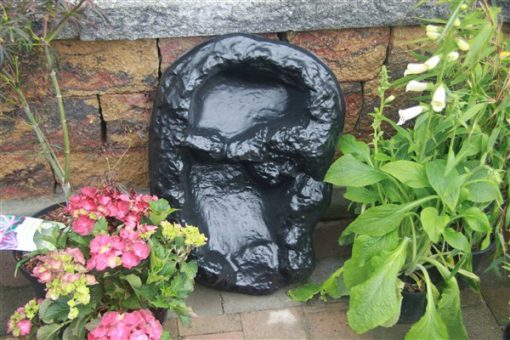
Where is `floor`? This screenshot has height=340, width=510. floor is located at coordinates (265, 318).